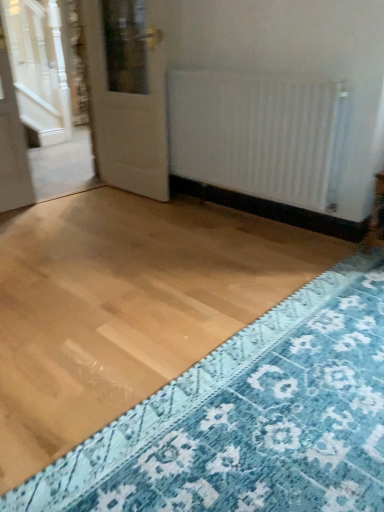
Describe the element at coordinates (128, 94) in the screenshot. The image size is (384, 512). I see `white glossy door at upper left` at that location.

Describe the element at coordinates (250, 418) in the screenshot. The image size is (384, 512). I see `blue textured rug at lower right` at that location.

Locate an element on the screen. white matte radiator at center is located at coordinates (258, 135).

Considering the relative positions of white matte radiator at center and white glossy door at upper left in the image provided, is white matte radiator at center to the left or to the right of white glossy door at upper left?

white matte radiator at center is to the right of white glossy door at upper left.

Does white matte radiator at center have a lesser height compared to white glossy door at upper left?

Indeed, white matte radiator at center has a lesser height compared to white glossy door at upper left.

The height and width of the screenshot is (512, 384). What are the coordinates of `radiator that appears on the right of white glossy door at upper left` in the screenshot? It's located at (258, 135).

How distant is blue textured rug at lower right from white matte radiator at center?

The distance of blue textured rug at lower right from white matte radiator at center is 1.21 meters.

Image resolution: width=384 pixels, height=512 pixels. I want to click on radiator that is above the blue textured rug at lower right (from a real-world perspective), so click(258, 135).

Can you confirm if blue textured rug at lower right is thinner than white matte radiator at center?

Incorrect, the width of blue textured rug at lower right is not less than that of white matte radiator at center.

From the image's perspective, does blue textured rug at lower right appear lower than white matte radiator at center?

Correct, blue textured rug at lower right appears lower than white matte radiator at center in the image.

From the image's perspective, between white glossy door at upper left and blue textured rug at lower right, who is located below?

blue textured rug at lower right, from the image's perspective.

In the scene shown: Who is bigger, white glossy door at upper left or blue textured rug at lower right?

With larger size is white glossy door at upper left.

Who is more distant, white glossy door at upper left or blue textured rug at lower right?

white glossy door at upper left is more distant.

Could you tell me if white glossy door at upper left is turned towards white matte radiator at center?

No.

In the image, there is a white matte radiator at center. At what (x,y) coordinates should I click in order to perform the action: click on door above it (from the image's perspective). Please return your answer as a coordinate pair (x, y). Image resolution: width=384 pixels, height=512 pixels. Looking at the image, I should click on [x=128, y=94].

Does point (164, 65) come behind point (237, 164)?

Yes.

Is white glossy door at upper left far away from white matte radiator at center?

Actually, white glossy door at upper left and white matte radiator at center are a little close together.

Can you tell me how much blue textured rug at lower right and white glossy door at upper left differ in facing direction?

The angular difference between blue textured rug at lower right and white glossy door at upper left is 85.6 degrees.

Measure the distance between blue textured rug at lower right and white glossy door at upper left.

A distance of 1.87 meters exists between blue textured rug at lower right and white glossy door at upper left.

Identify the location of door located above the blue textured rug at lower right (from the image's perspective). (128, 94).

Is white glossy door at upper left completely or partially inside blue textured rug at lower right?

No.

Which is in front, point (309, 95) or point (238, 409)?

The point (238, 409) is closer.

Would you consider white matte radiator at center to be distant from blue textured rug at lower right?

Yes, white matte radiator at center and blue textured rug at lower right are located far from each other.

Can you confirm if white matte radiator at center is bigger than blue textured rug at lower right?

Indeed, white matte radiator at center has a larger size compared to blue textured rug at lower right.

Where is `radiator that appears on the right of white glossy door at upper left`? radiator that appears on the right of white glossy door at upper left is located at coordinates (258, 135).

In order to click on radiator behind the blue textured rug at lower right in this screenshot , I will do `click(258, 135)`.

Looking at the image, which one is located further to white glossy door at upper left, white matte radiator at center or blue textured rug at lower right?

The object further to white glossy door at upper left is blue textured rug at lower right.

When comparing their distances from blue textured rug at lower right, does white glossy door at upper left or white matte radiator at center seem further?

white glossy door at upper left lies further to blue textured rug at lower right than the other object.

Which object lies further to the anchor point blue textured rug at lower right, white matte radiator at center or white glossy door at upper left?

white glossy door at upper left.

From the image, which object appears to be nearer to white matte radiator at center, blue textured rug at lower right or white glossy door at upper left?

white glossy door at upper left is closer to white matte radiator at center.

When comparing their distances from white matte radiator at center, does white glossy door at upper left or blue textured rug at lower right seem closer?

The object closer to white matte radiator at center is white glossy door at upper left.

Based on their spatial positions, is blue textured rug at lower right or white matte radiator at center further from white glossy door at upper left?

Based on the image, blue textured rug at lower right appears to be further to white glossy door at upper left.

Identify the location of radiator located between blue textured rug at lower right and white glossy door at upper left in the depth direction. (258, 135).